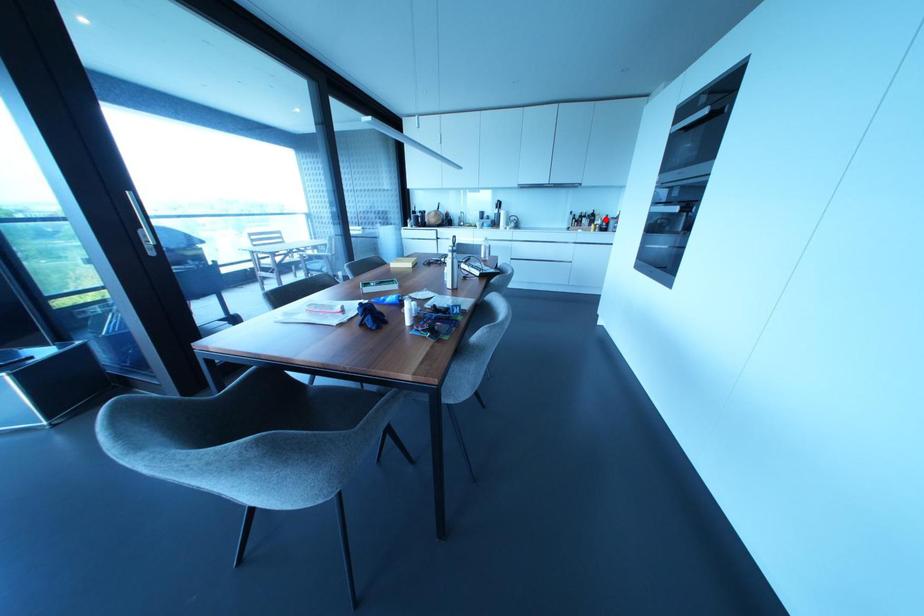
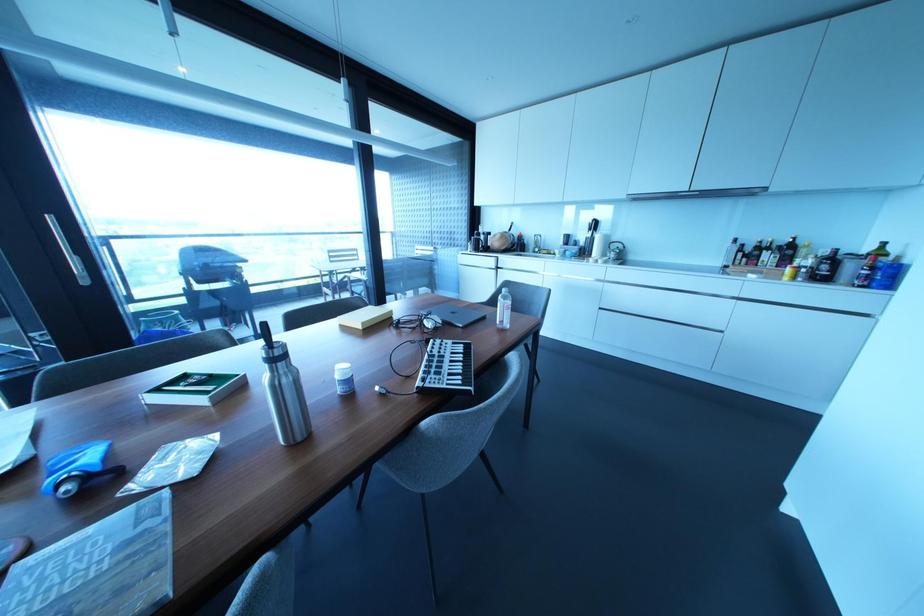
Question: I am providing you with two images of the same scene from different viewpoints. A red point is shown in image1. For the corresponding object point in image2, is it positioned nearer or farther from the camera?

Choices:
 (A) Nearer
 (B) Farther

Answer: (B)